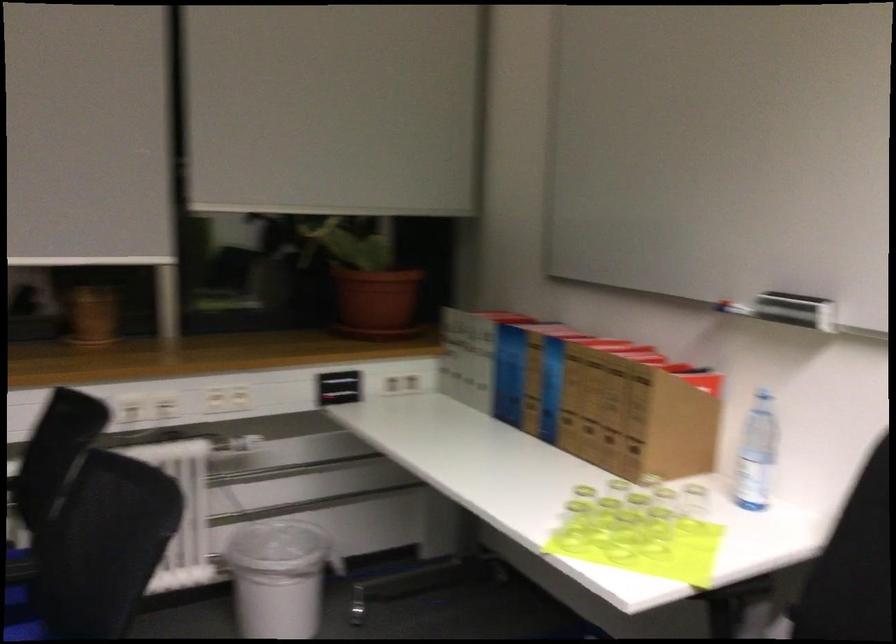
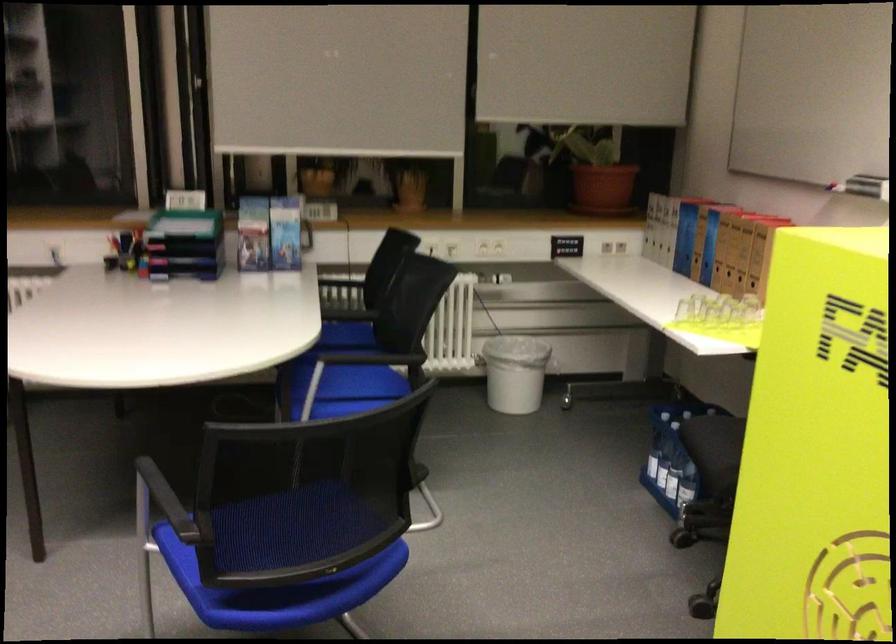
Where in the second image is the point corresponding to point (586, 402) from the first image?

(730, 251)